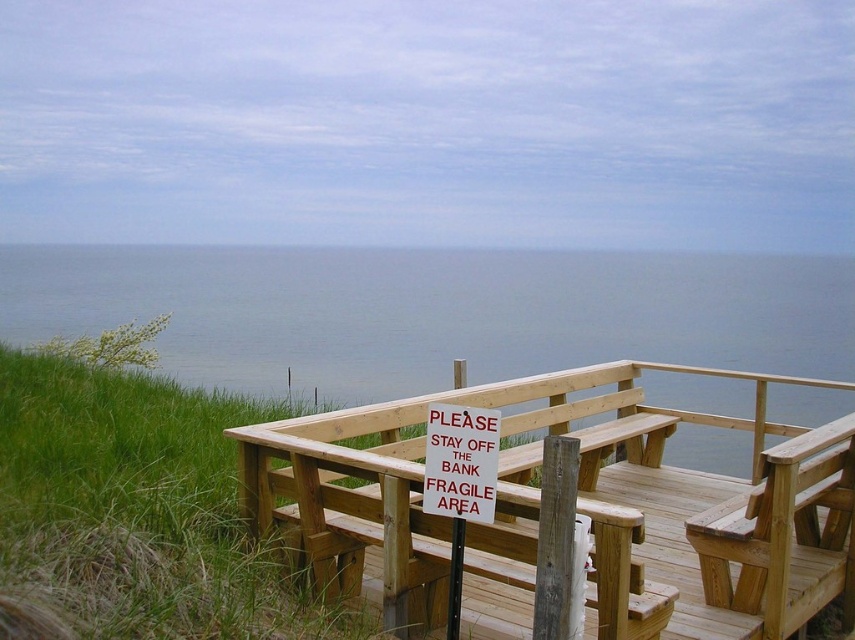
Question: Is blue water at upper center below white paper sign at center?

Choices:
 (A) no
 (B) yes

Answer: (A)

Question: Which point is farther to the camera?

Choices:
 (A) wooden bench at center
 (B) white paper sign at center
 (C) blue water at upper center

Answer: (C)

Question: Does blue water at upper center come behind wooden bench at center?

Choices:
 (A) no
 (B) yes

Answer: (B)

Question: Among these points, which one is nearest to the camera?

Choices:
 (A) (728, 371)
 (B) (431, 432)
 (C) (284, 300)

Answer: (B)

Question: Can you confirm if blue water at upper center is positioned below white paper sign at center?

Choices:
 (A) no
 (B) yes

Answer: (A)

Question: Which object is positioned closest to the blue water at upper center?

Choices:
 (A) white paper sign at center
 (B) wooden bench at center

Answer: (B)